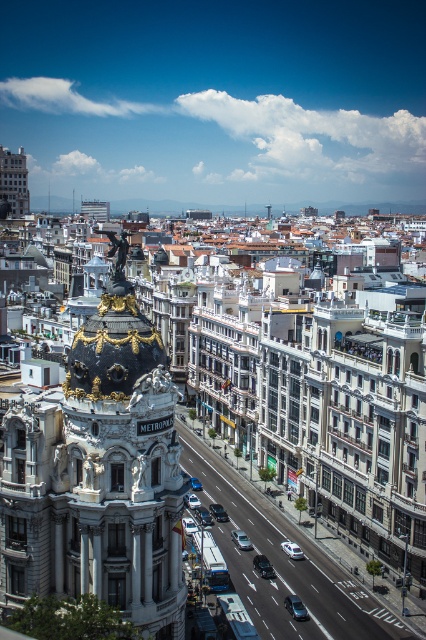
Question: In this image, where is matte gray building at upper left located relative to metallic silver car at center?

Choices:
 (A) above
 (B) below

Answer: (A)

Question: Which of these objects is positioned farthest from the shiny blue car at center?

Choices:
 (A) silver/golden ornate dome at center-left
 (B) metallic silver car at center
 (C) shiny blue sedan at center
 (D) silver metallic car at center

Answer: (C)

Question: Is gold/gilded statue at upper center bigger than silver metallic car at center?

Choices:
 (A) no
 (B) yes

Answer: (B)

Question: Is gold/gilded statue at upper center closer to camera compared to metallic silver car at center?

Choices:
 (A) yes
 (B) no

Answer: (A)

Question: Which object is the farthest from the matte gray building at upper left?

Choices:
 (A) silver metallic car at center
 (B) shiny blue sedan at center
 (C) shiny blue car at center

Answer: (B)

Question: Which object appears farthest from the camera in this image?

Choices:
 (A) gold/gilded statue at upper center
 (B) shiny blue sedan at center
 (C) silver metallic car at center

Answer: (C)